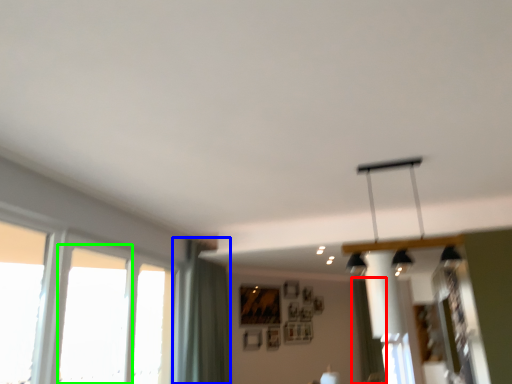
Question: Which object is positioned closest to curtain (highlighted by a red box)? Select from curtain (highlighted by a blue box) and window (highlighted by a green box).

Choices:
 (A) curtain
 (B) window

Answer: (A)